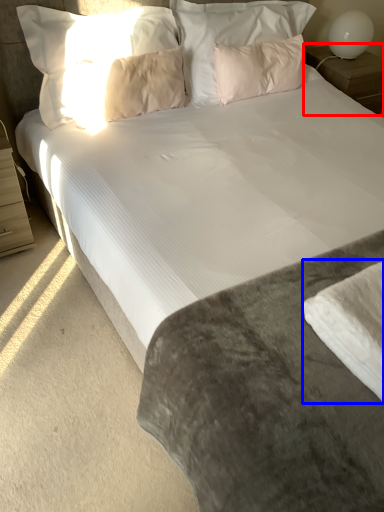
Question: Which of the following is the farthest to the observer, nightstand (highlighted by a red box) or sheet (highlighted by a blue box)?

Choices:
 (A) nightstand
 (B) sheet

Answer: (A)